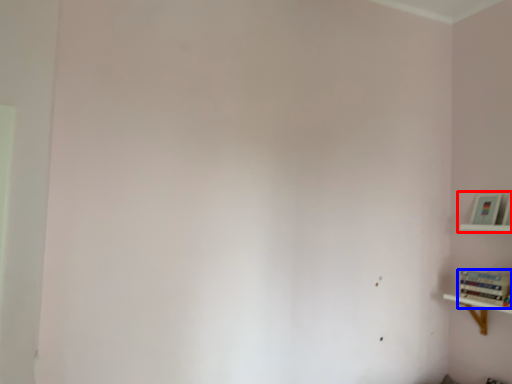
Question: Which point is further to the camera, shelf (highlighted by a red box) or book (highlighted by a blue box)?

Choices:
 (A) shelf
 (B) book

Answer: (A)